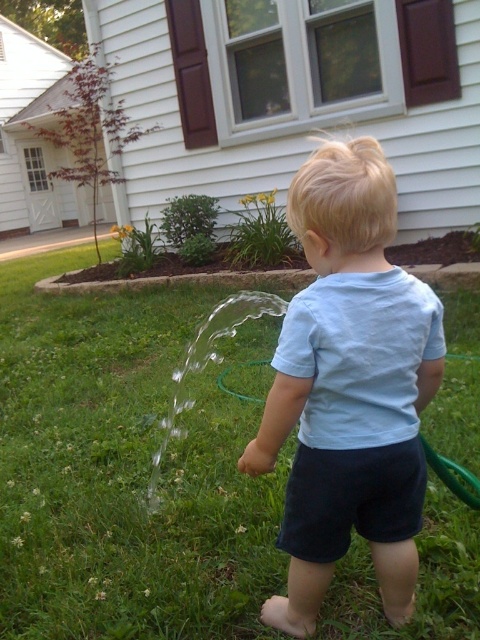
You are a gardener who needs to lay a new sod strip across the area where the green grass at center and light blue cotton shirt at center are located. Which area requires a wider sod strip based on their widths?

The green grass at center requires a wider sod strip because its width is larger than the light blue cotton shirt at center.

You are a gardener who needs to decide which area to water first. The green grass at center and the green rubber hose at lower center are both in your view. Which one has a larger area that needs attention?

The green grass at center is bigger than the green rubber hose at lower center, so the gardener should prioritize watering the green grass at center first as it covers a larger area.